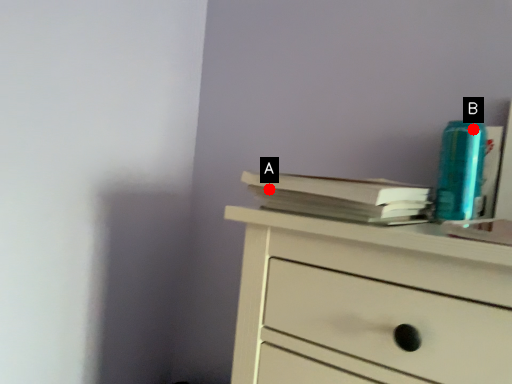
Question: Two points are circled on the image, labeled by A and B beside each circle. Which point appears farthest from the camera in this image?

Choices:
 (A) A is further
 (B) B is further

Answer: (B)